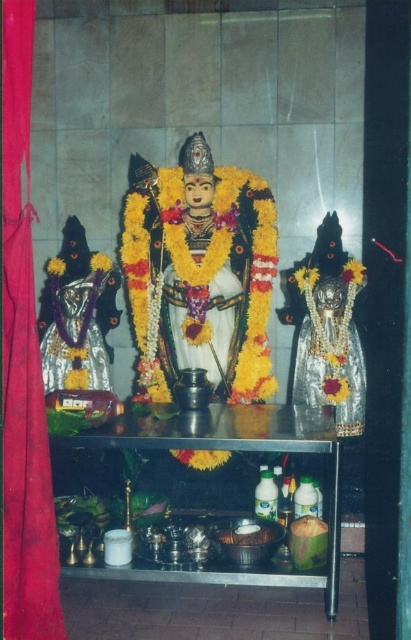
Question: Is white glossy statue at center in front of metallic table at center?

Choices:
 (A) yes
 (B) no

Answer: (B)

Question: Is metallic table at center to the left of white matte coconut at center from the viewer's perspective?

Choices:
 (A) no
 (B) yes

Answer: (A)

Question: Among these objects, which one is farthest from the camera?

Choices:
 (A) white matte coconut at center
 (B) metallic table at center

Answer: (A)

Question: In this image, where is white glossy statue at center located relative to white matte coconut at center?

Choices:
 (A) left
 (B) right

Answer: (A)

Question: Which object appears closest to the camera in this image?

Choices:
 (A) white matte coconut at center
 (B) metallic table at center
 (C) white glossy statue at center

Answer: (B)

Question: Which object appears farthest from the camera in this image?

Choices:
 (A) metallic table at center
 (B) white glossy statue at center
 (C) white matte coconut at center

Answer: (B)